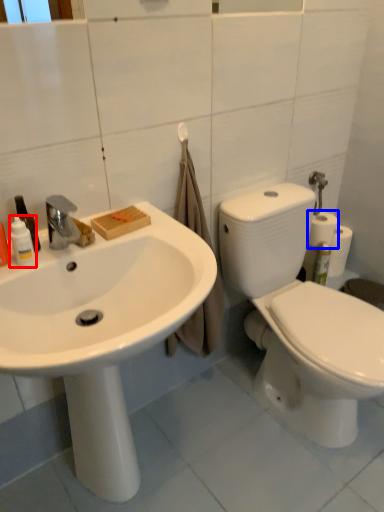
Question: Which point is further to the camera, toiletry (highlighted by a red box) or toilet paper (highlighted by a blue box)?

Choices:
 (A) toiletry
 (B) toilet paper

Answer: (B)